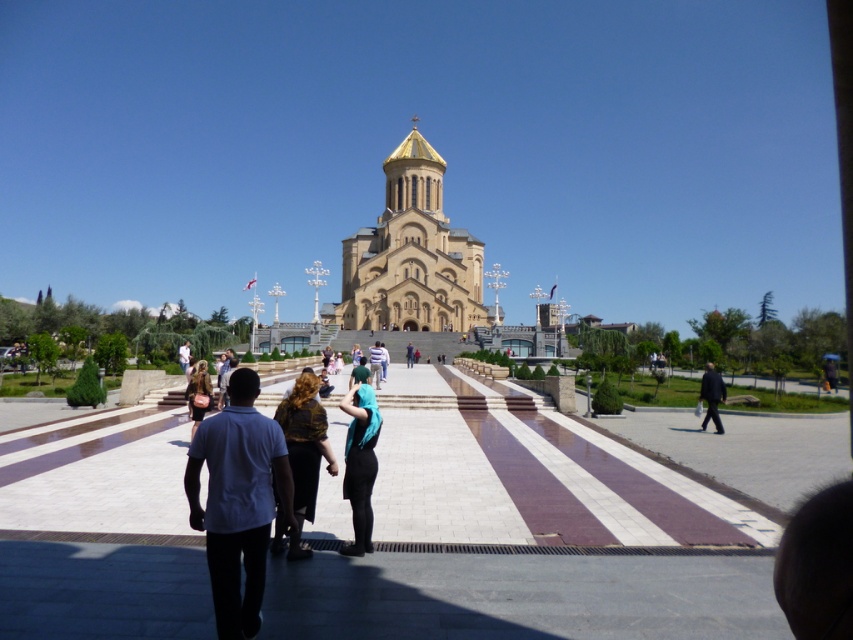
Between striped shirt at center and dark blue fabric jacket at center, which one has more height?

With more height is striped shirt at center.

Who is positioned more to the left, striped shirt at center or dark blue fabric jacket at center?

Positioned to the left is striped shirt at center.

Measure the distance between striped shirt at center and camera.

The distance of striped shirt at center from camera is 99.95 meters.

Locate an element on the screen. Image resolution: width=853 pixels, height=640 pixels. striped shirt at center is located at coordinates (375, 364).

Does matte black dress at center appear on the right side of dark blue fabric jacket at center?

No, matte black dress at center is not to the right of dark blue fabric jacket at center.

This screenshot has height=640, width=853. I want to click on matte black dress at center, so click(x=198, y=394).

What are the coordinates of `matte black dress at center` in the screenshot? It's located at (198, 394).

Does beige stone church at center have a smaller size compared to black suit at right?

No.

Does beige stone church at center appear under black suit at right?

No.

Locate an element on the screen. The height and width of the screenshot is (640, 853). beige stone church at center is located at coordinates (410, 256).

Locate an element on the screen. This screenshot has width=853, height=640. beige stone church at center is located at coordinates pyautogui.click(x=410, y=256).